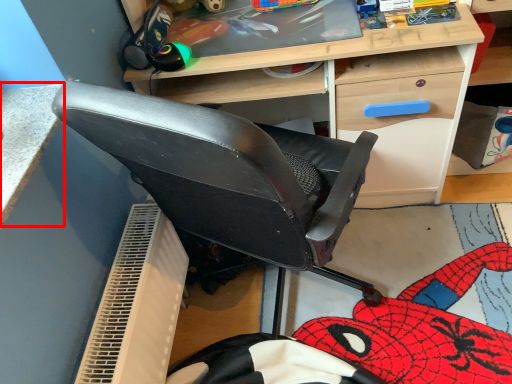
Question: From the image, what is the correct spatial relationship of table (annotated by the red box) in relation to desk?

Choices:
 (A) left
 (B) right

Answer: (A)